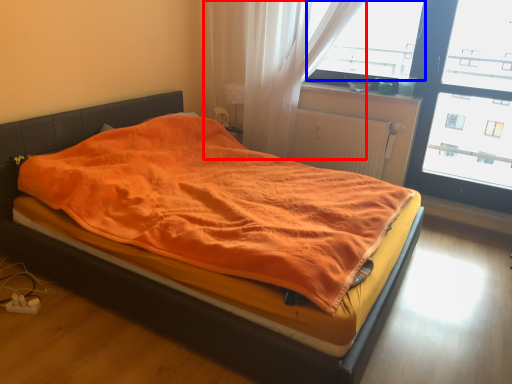
Question: Which object is further to the camera taking this photo, curtain (highlighted by a red box) or window screen (highlighted by a blue box)?

Choices:
 (A) curtain
 (B) window screen

Answer: (B)